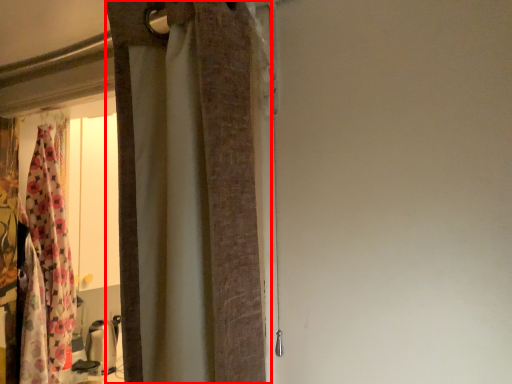
Question: From the image's perspective, what is the correct spatial relationship of curtain (annotated by the red box) in relation to curtain?

Choices:
 (A) above
 (B) below

Answer: (A)